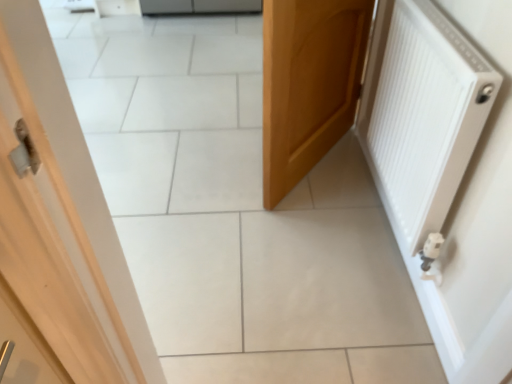
The width and height of the screenshot is (512, 384). What are the coordinates of `free spot in front of wooden door at center` in the screenshot? It's located at (313, 253).